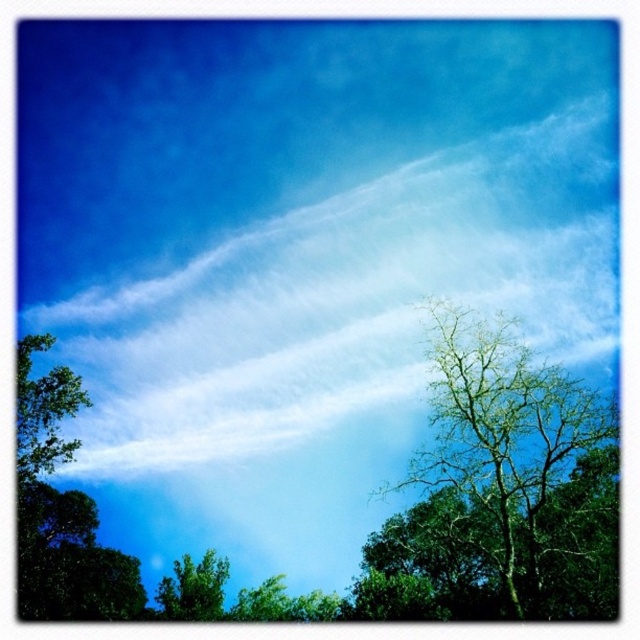
Between white cotton cloud at upper center and green leafy tree at center, which one is positioned lower?

green leafy tree at center is below.

Is white cotton cloud at upper center positioned before green leafy tree at center?

That is False.

The height and width of the screenshot is (640, 640). Identify the location of white cotton cloud at upper center. (340, 296).

Does point (602, 400) come closer to viewer compared to point (211, 556)?

Yes, point (602, 400) is in front of point (211, 556).

Who is more forward, (532,413) or (216,593)?

Point (532,413)

What do you see at coordinates (493, 458) in the screenshot?
I see `green leafy tree at center` at bounding box center [493, 458].

Where is `green leafy tree at center`? This screenshot has height=640, width=640. green leafy tree at center is located at coordinates (493, 458).

Can you confirm if green leafy tree at center is taller than green leafy tree at left?

Correct, green leafy tree at center is much taller as green leafy tree at left.

Image resolution: width=640 pixels, height=640 pixels. What are the coordinates of `green leafy tree at center` in the screenshot? It's located at (493, 458).

The width and height of the screenshot is (640, 640). Find the location of `green leafy tree at center`. green leafy tree at center is located at coordinates (493, 458).